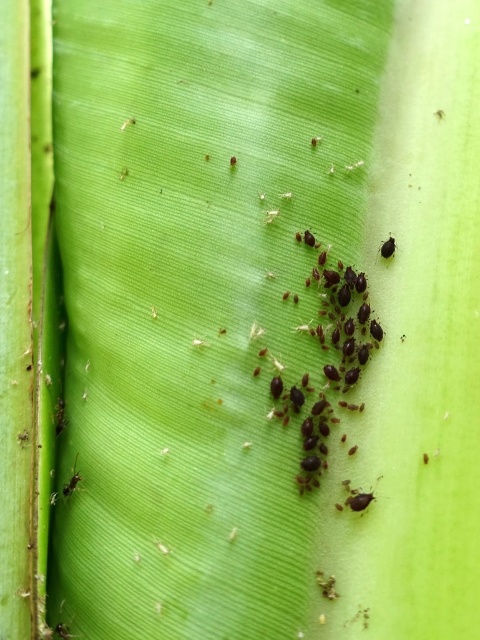
Question: Which point is closer to the camera taking this photo?

Choices:
 (A) (320, 328)
 (B) (387, 250)

Answer: (A)

Question: Which of the following is the farthest from the observer?

Choices:
 (A) black matte ant at lower left
 (B) black matte insect at upper right

Answer: (B)

Question: Which object is positioned farthest from the black matte insect at upper right?

Choices:
 (A) black matte ant at lower left
 (B) black matte insects at center

Answer: (A)

Question: Does black matte ant at lower left appear under black matte insect at upper right?

Choices:
 (A) no
 (B) yes

Answer: (B)

Question: Does black matte ant at lower left appear on the left side of black matte insect at upper right?

Choices:
 (A) yes
 (B) no

Answer: (A)

Question: Can you confirm if black matte insects at center is thinner than black matte ant at lower left?

Choices:
 (A) yes
 (B) no

Answer: (B)